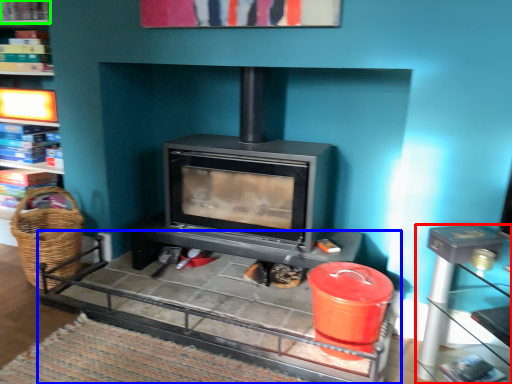
Question: Considering the real-world distances, which object is farthest from table (highlighted by a red box)? table (highlighted by a blue box) or shelf (highlighted by a green box)?

Choices:
 (A) table
 (B) shelf

Answer: (B)